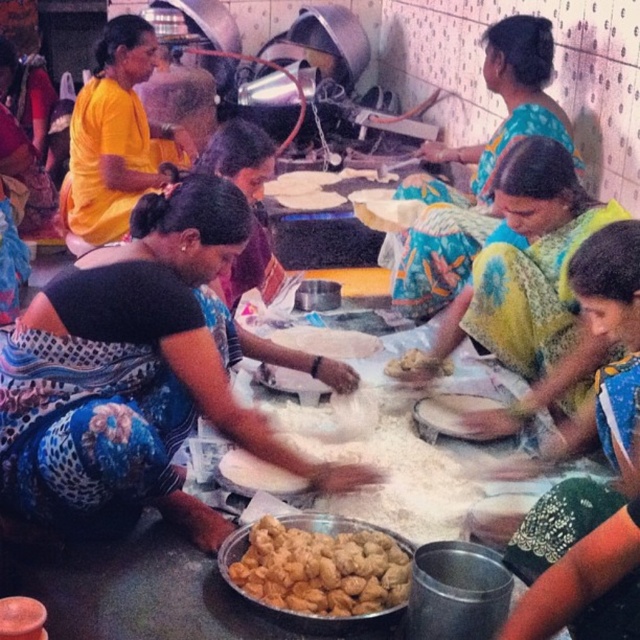
Question: Among these objects, which one is nearest to the camera?

Choices:
 (A) blue printed saree at center
 (B) printed cotton saree at center

Answer: (A)

Question: Does blue printed saree at center have a greater width compared to yellow fabric at upper left?

Choices:
 (A) no
 (B) yes

Answer: (B)

Question: Based on their relative distances, which object is farther from the brown dough at center?

Choices:
 (A) yellow floral saree at center
 (B) yellow fabric at upper left
 (C) white flour at center
 (D) blue printed saree at center

Answer: (B)

Question: Is blue printed saree at center smaller than yellow fabric at upper left?

Choices:
 (A) yes
 (B) no

Answer: (A)

Question: Which of the following is the closest to the observer?

Choices:
 (A) (106, 140)
 (B) (324, 580)

Answer: (B)

Question: Is yellow fabric at upper left closer to the viewer compared to brown dough at center?

Choices:
 (A) no
 (B) yes

Answer: (B)